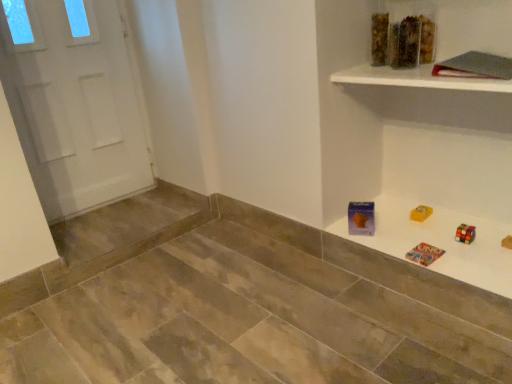
Locate an element on the screen. vacant space to the right of translucent plastic container at upper right, which appears as the 1th toy when viewed from the left is located at coordinates (443, 60).